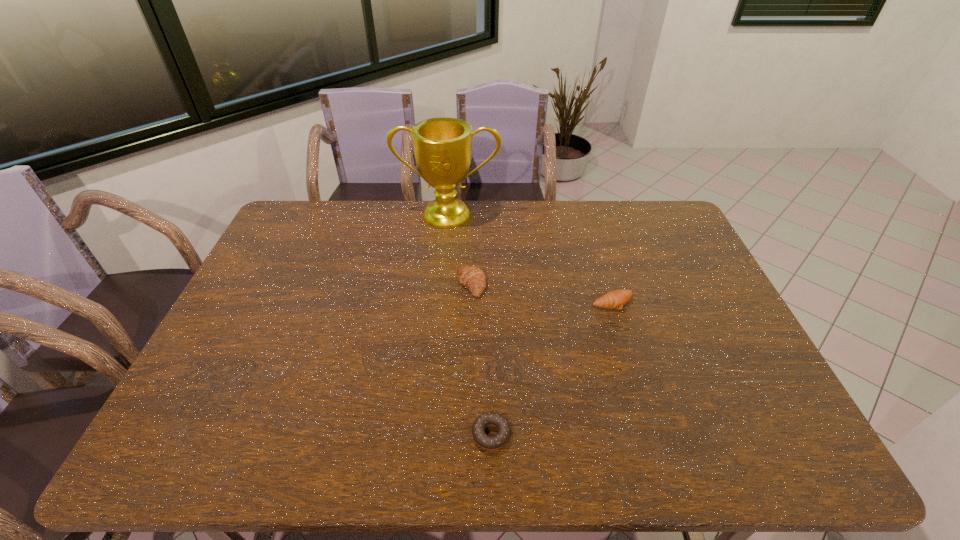
The image size is (960, 540). In order to click on free location that satisfies the following two spatial constraints: 1. on the back side of the doughnut; 2. on the right side of the right crescent roll in this screenshot , I will do `click(489, 302)`.